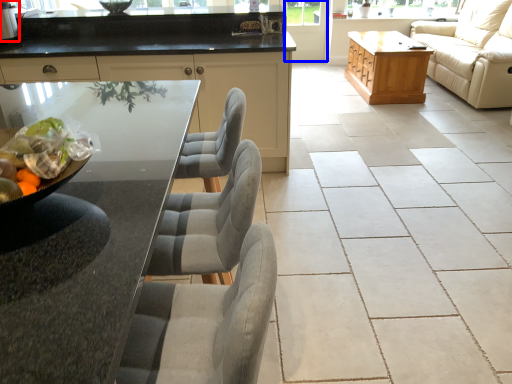
Question: Which point is further to the camera, appliance (highlighted by a red box) or screen door (highlighted by a blue box)?

Choices:
 (A) appliance
 (B) screen door

Answer: (B)